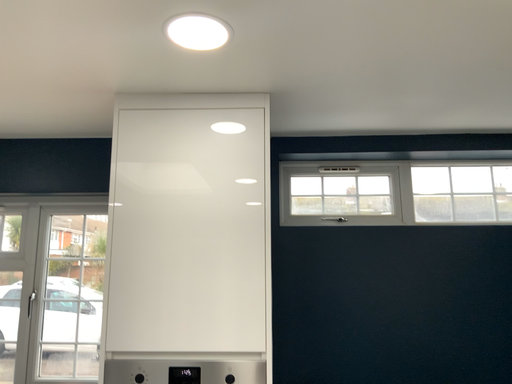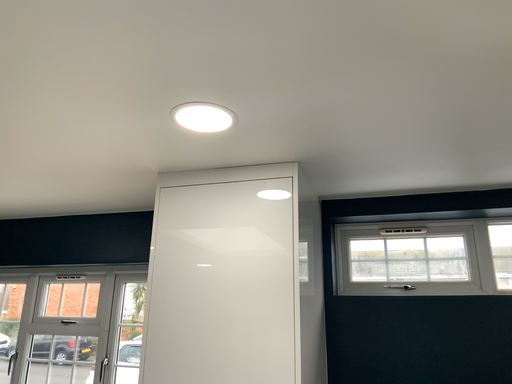
Question: Which way did the camera rotate in the video?

Choices:
 (A) rotated left
 (B) rotated right

Answer: (A)